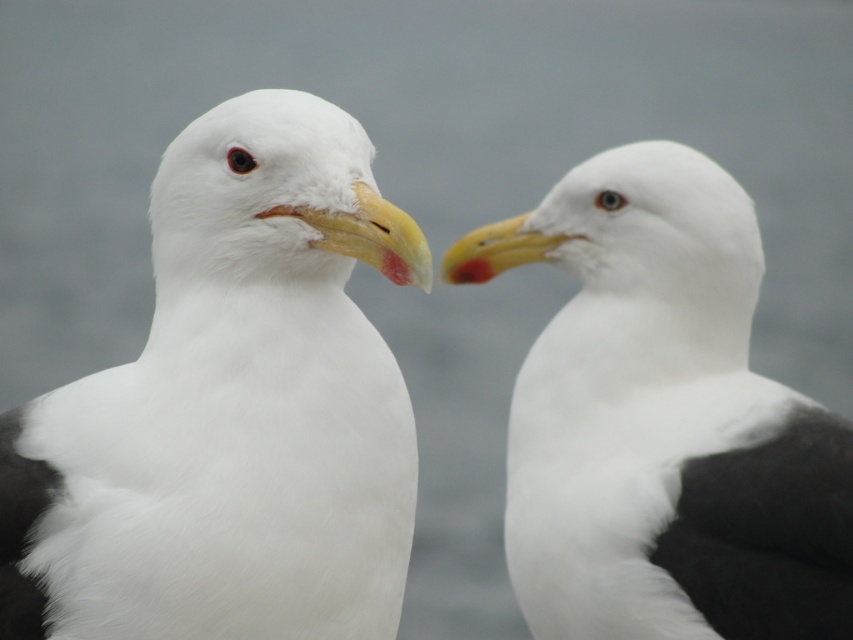
You are a photographer trying to capture the white fluffy seagull at center. The camera is set to focus on the point at coordinates point (231,410). Will this point be the best focus point for the seagull?

Yes, the white fluffy seagull at center is represented by point (231,410), so focusing there will ensure the seagull is sharply captured.

You are a birdwatcher observing two seagulls in the image. The white fluffy seagull at center and the white matte seagull at center. Which one is positioned higher in the image?

The white fluffy seagull at center is located above the white matte seagull at center, so it is positioned higher in the image.

You are standing at a point 8.26 feet away from the point labeled as point (200,116) in the image. If you want to move closer to that point, which direction should you move?

The point labeled point (200,116) is 8.26 feet away from the viewer. To move closer to it, you should move forward towards the point labeled point (200,116).